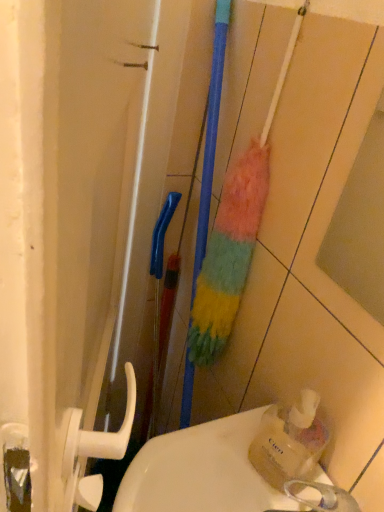
Identify the location of translucent plastic soap dispenser at lower right. The image size is (384, 512). (289, 441).

Where is `multicolored fuzzy brush at center`? The image size is (384, 512). multicolored fuzzy brush at center is located at coordinates (234, 236).

Describe the element at coordinates (234, 236) in the screenshot. I see `multicolored fuzzy brush at center` at that location.

Locate an element on the screen. The image size is (384, 512). translucent plastic soap dispenser at lower right is located at coordinates (289, 441).

Considering the sizes of objects white glossy sink at lower center and multicolored fuzzy brush at center in the image provided, who is taller, white glossy sink at lower center or multicolored fuzzy brush at center?

With more height is multicolored fuzzy brush at center.

Looking at this image, could you tell me if white glossy sink at lower center is turned towards multicolored fuzzy brush at center?

No, white glossy sink at lower center is not turned towards multicolored fuzzy brush at center.

What's the angular difference between white glossy sink at lower center and multicolored fuzzy brush at center's facing directions?

2.03 degrees separate the facing orientations of white glossy sink at lower center and multicolored fuzzy brush at center.

Looking at the image, does white glossy sink at lower center seem bigger or smaller compared to multicolored fuzzy brush at center?

white glossy sink at lower center is bigger than multicolored fuzzy brush at center.

From the image's perspective, which object appears higher, translucent plastic soap dispenser at lower right or multicolored fuzzy brush at center?

multicolored fuzzy brush at center.

Between translucent plastic soap dispenser at lower right and multicolored fuzzy brush at center, which one has more height?

multicolored fuzzy brush at center is taller.

Does point (284, 482) appear closer or farther from the camera than point (245, 209)?

Point (284, 482) appears to be closer to the viewer than point (245, 209).

Can multicolored fuzzy brush at center be found inside translucent plastic soap dispenser at lower right?

No, multicolored fuzzy brush at center is not inside translucent plastic soap dispenser at lower right.

Is point (303, 421) less distant than point (202, 444)?

That is True.

From the image's perspective, between translucent plastic soap dispenser at lower right and white glossy sink at lower center, who is located below?

white glossy sink at lower center, from the image's perspective.

Is translucent plastic soap dispenser at lower right positioned far away from white glossy sink at lower center?

No, translucent plastic soap dispenser at lower right is not far away from white glossy sink at lower center.

Consider the image. Would you say multicolored fuzzy brush at center is to the left or to the right of translucent plastic soap dispenser at lower right in the picture?

multicolored fuzzy brush at center is positioned on translucent plastic soap dispenser at lower right's left side.

Between multicolored fuzzy brush at center and translucent plastic soap dispenser at lower right, which one has larger width?

multicolored fuzzy brush at center.

From the image's perspective, does multicolored fuzzy brush at center appear higher than translucent plastic soap dispenser at lower right?

Indeed, from the image's perspective, multicolored fuzzy brush at center is shown above translucent plastic soap dispenser at lower right.

Which is nearer, (250,199) or (309,464)?

Point (250,199) is farther from the camera than point (309,464).

How many degrees apart are the facing directions of multicolored fuzzy brush at center and white glossy sink at lower center?

The facing directions of multicolored fuzzy brush at center and white glossy sink at lower center are 2.03 degrees apart.

Does point (238, 201) come in front of point (291, 509)?

No, it is not.

Considering the relative positions of multicolored fuzzy brush at center and white glossy sink at lower center in the image provided, is multicolored fuzzy brush at center to the left or to the right of white glossy sink at lower center?

Based on their positions, multicolored fuzzy brush at center is located to the right of white glossy sink at lower center.

Who is bigger, multicolored fuzzy brush at center or white glossy sink at lower center?

With larger size is white glossy sink at lower center.

Considering the positions of objects white glossy sink at lower center and translucent plastic soap dispenser at lower right in the image provided, who is more to the right, white glossy sink at lower center or translucent plastic soap dispenser at lower right?

Positioned to the right is translucent plastic soap dispenser at lower right.

From the image's perspective, which object appears higher, white glossy sink at lower center or translucent plastic soap dispenser at lower right?

translucent plastic soap dispenser at lower right appears higher in the image.

Can you confirm if white glossy sink at lower center is thinner than translucent plastic soap dispenser at lower right?

No.

Choose the correct answer: Is white glossy sink at lower center inside translucent plastic soap dispenser at lower right or outside it?

white glossy sink at lower center is not inside translucent plastic soap dispenser at lower right, it's outside.

Locate an element on the screen. brush lying behind the white glossy sink at lower center is located at coordinates (234, 236).

At what (x,y) coordinates should I click in order to perform the action: click on bottle in front of the multicolored fuzzy brush at center. Please return your answer as a coordinate pair (x, y). Looking at the image, I should click on (289, 441).

Considering their positions, is translucent plastic soap dispenser at lower right positioned closer to multicolored fuzzy brush at center than white glossy sink at lower center?

Based on the image, translucent plastic soap dispenser at lower right appears to be nearer to multicolored fuzzy brush at center.

When comparing their distances from white glossy sink at lower center, does translucent plastic soap dispenser at lower right or multicolored fuzzy brush at center seem further?

multicolored fuzzy brush at center lies further to white glossy sink at lower center than the other object.

Which object lies nearer to the anchor point white glossy sink at lower center, multicolored fuzzy brush at center or translucent plastic soap dispenser at lower right?

Among the two, translucent plastic soap dispenser at lower right is located nearer to white glossy sink at lower center.

Which object lies nearer to the anchor point translucent plastic soap dispenser at lower right, white glossy sink at lower center or multicolored fuzzy brush at center?

white glossy sink at lower center is positioned closer to the anchor translucent plastic soap dispenser at lower right.

Estimate the real-world distances between objects in this image. Which object is further from translucent plastic soap dispenser at lower right, multicolored fuzzy brush at center or white glossy sink at lower center?

Based on the image, multicolored fuzzy brush at center appears to be further to translucent plastic soap dispenser at lower right.

Estimate the real-world distances between objects in this image. Which object is further from multicolored fuzzy brush at center, white glossy sink at lower center or translucent plastic soap dispenser at lower right?

Among the two, white glossy sink at lower center is located further to multicolored fuzzy brush at center.

Identify the location of bottle between multicolored fuzzy brush at center and white glossy sink at lower center from top to bottom. (289, 441).